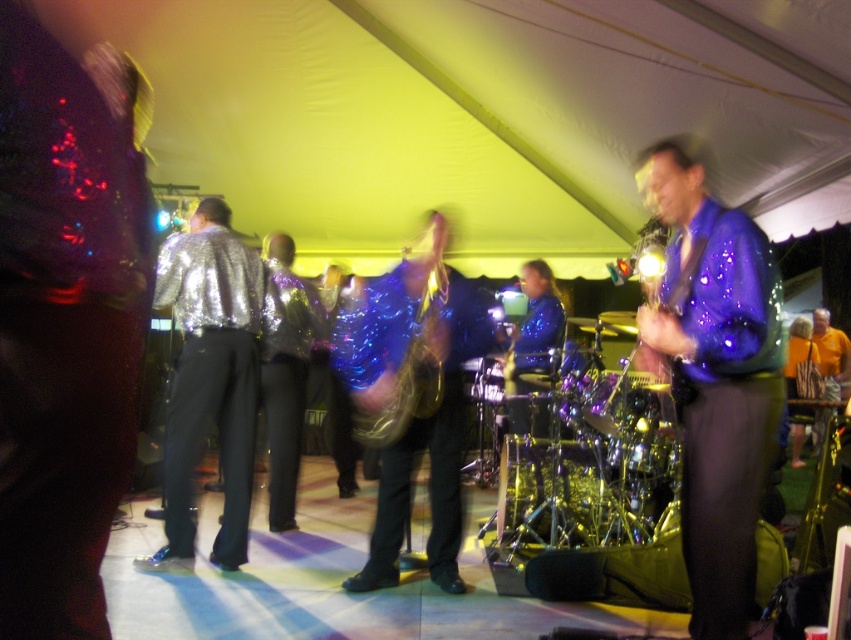
You are a photographer at the event and want to capture a clear photo of both the shiny purple jacket at right and the shiny metallic drum at center. Since you can only focus on one object at a time, which object should you focus on to ensure the other is still in the background?

You should focus on the shiny purple jacket at right because it is in front of the shiny metallic drum at center, so the drum will naturally be in the background when the jacket is in focus.